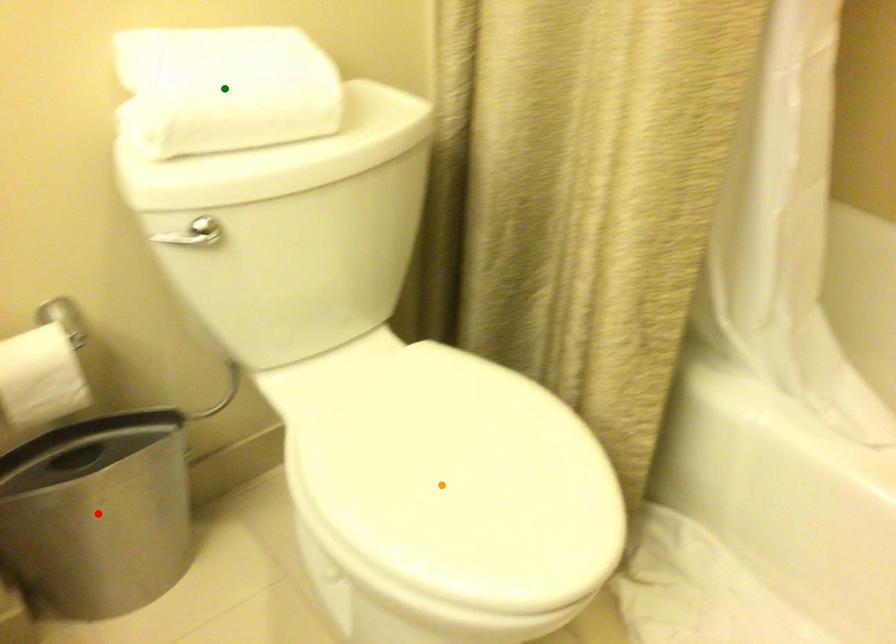
Order these from nearest to farthest:
1. orange point
2. green point
3. red point

orange point
green point
red point